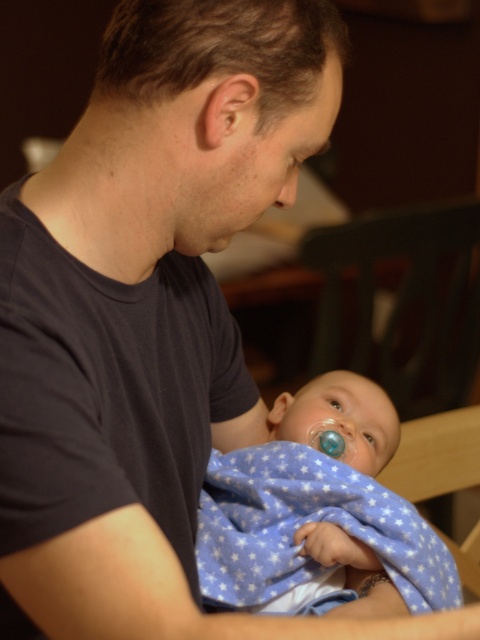
Question: Where is blue flannel blanket at center located in relation to translucent blue pacifier at center in the image?

Choices:
 (A) right
 (B) left

Answer: (B)

Question: From the image, what is the correct spatial relationship of blue flannel blanket at center in relation to translucent blue pacifier at center?

Choices:
 (A) right
 (B) left

Answer: (B)

Question: Is blue flannel blanket at center below translucent blue pacifier at center?

Choices:
 (A) no
 (B) yes

Answer: (B)

Question: Which point is closer to the camera?

Choices:
 (A) (282, 593)
 (B) (312, 424)

Answer: (A)

Question: Which object is closer to the camera taking this photo?

Choices:
 (A) translucent blue pacifier at center
 (B) blue flannel blanket at center

Answer: (B)